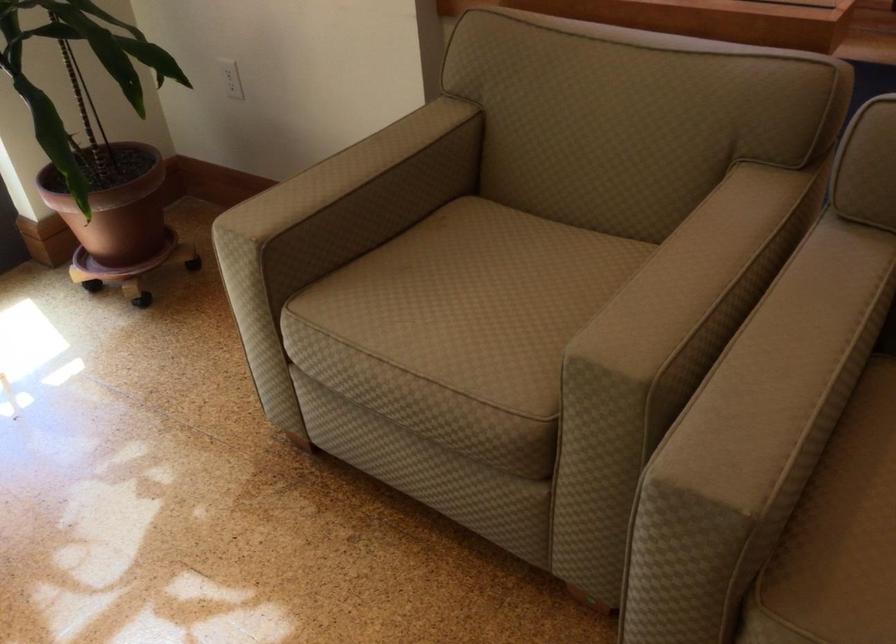
Locate an element on the screen. This screenshot has width=896, height=644. white power outlet is located at coordinates (231, 79).